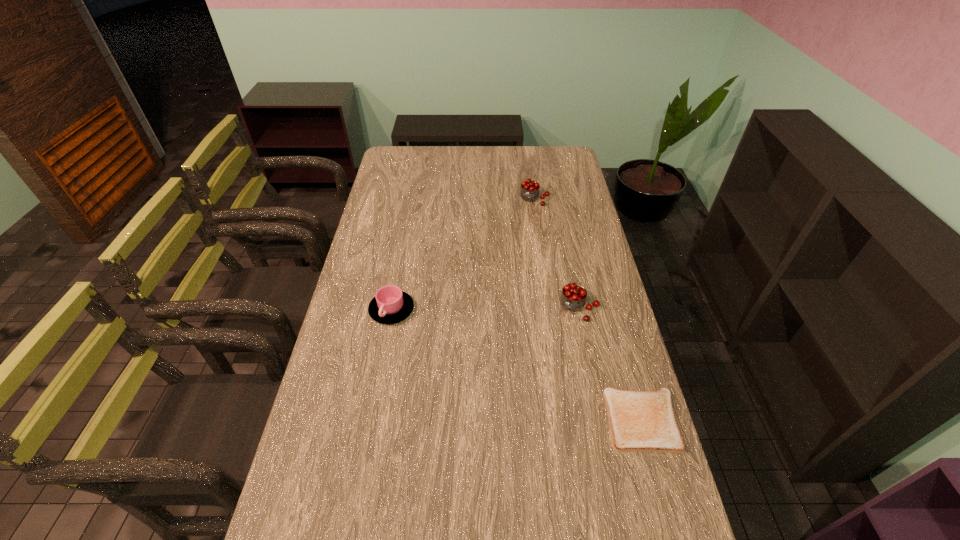
Where is `object that is the third closest to the nearest object`? This screenshot has width=960, height=540. object that is the third closest to the nearest object is located at coordinates (529, 192).

The width and height of the screenshot is (960, 540). What are the coordinates of `vacant space that satisfies the following two spatial constraints: 1. on the side with the handle of the leftmost object; 2. on the left side of the shortest object` in the screenshot? It's located at (372, 420).

Locate an element on the screen. free space that satisfies the following two spatial constraints: 1. on the side with the handle of the toast; 2. on the left side of the cup is located at coordinates (372, 420).

I want to click on vacant space that satisfies the following two spatial constraints: 1. on the front side of the toast; 2. on the left side of the nearer pot filled with cherries, so click(x=600, y=420).

You are a GUI agent. You are given a task and a screenshot of the screen. Output one action in this format:
    pyautogui.click(x=<x>, y=<y>)
    Task: Click on the vacant point that satisfies the following two spatial constraints: 1. on the side with the handle of the shortest object; 2. on the right side of the third tallest object
    
    Given the screenshot: What is the action you would take?
    pyautogui.click(x=372, y=420)